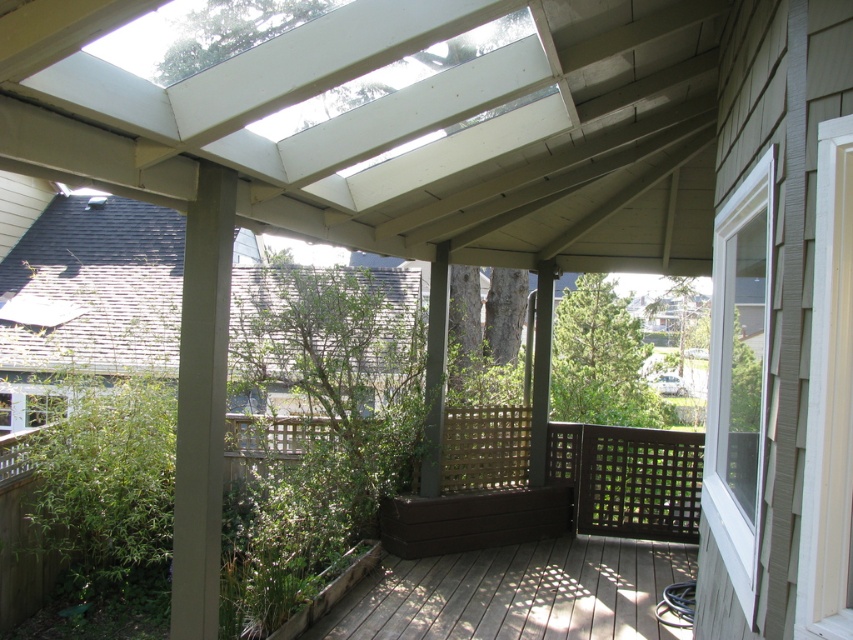
From the picture: Measure the distance between brown wood deck at lower center and brown wooden bench at center.

brown wood deck at lower center is 1.29 meters from brown wooden bench at center.

Is brown wood deck at lower center thinner than brown wooden bench at center?

In fact, brown wood deck at lower center might be wider than brown wooden bench at center.

The image size is (853, 640). Identify the location of brown wood deck at lower center. (515, 593).

Does brown wood deck at lower center have a larger size compared to white plastic window at right?

Actually, brown wood deck at lower center might be smaller than white plastic window at right.

Between brown wood deck at lower center and white plastic window at right, which one is positioned lower?

brown wood deck at lower center

This screenshot has width=853, height=640. Find the location of `brown wood deck at lower center`. brown wood deck at lower center is located at coordinates (515, 593).

Does white plastic window at right have a lesser height compared to brown wooden bench at center?

In fact, white plastic window at right may be taller than brown wooden bench at center.

Can you confirm if white plastic window at right is positioned above brown wooden bench at center?

Indeed, white plastic window at right is positioned over brown wooden bench at center.

At what (x,y) coordinates should I click in order to perform the action: click on white plastic window at right. Please return your answer as a coordinate pair (x, y). The height and width of the screenshot is (640, 853). Looking at the image, I should click on (740, 378).